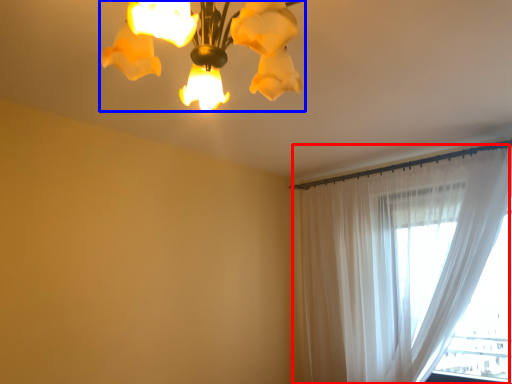
Question: Which object appears farthest to the camera in this image, curtain (highlighted by a red box) or lamp (highlighted by a blue box)?

Choices:
 (A) curtain
 (B) lamp

Answer: (A)